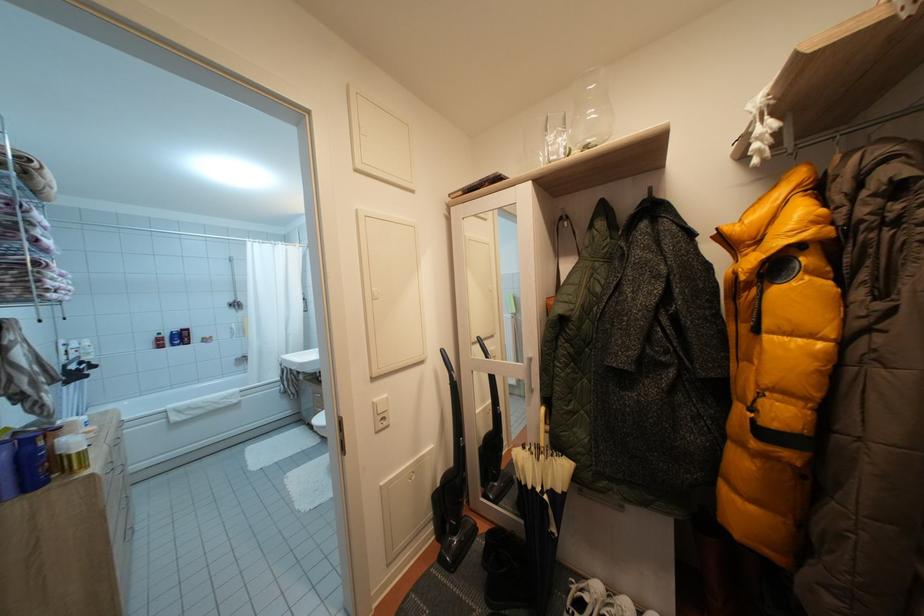
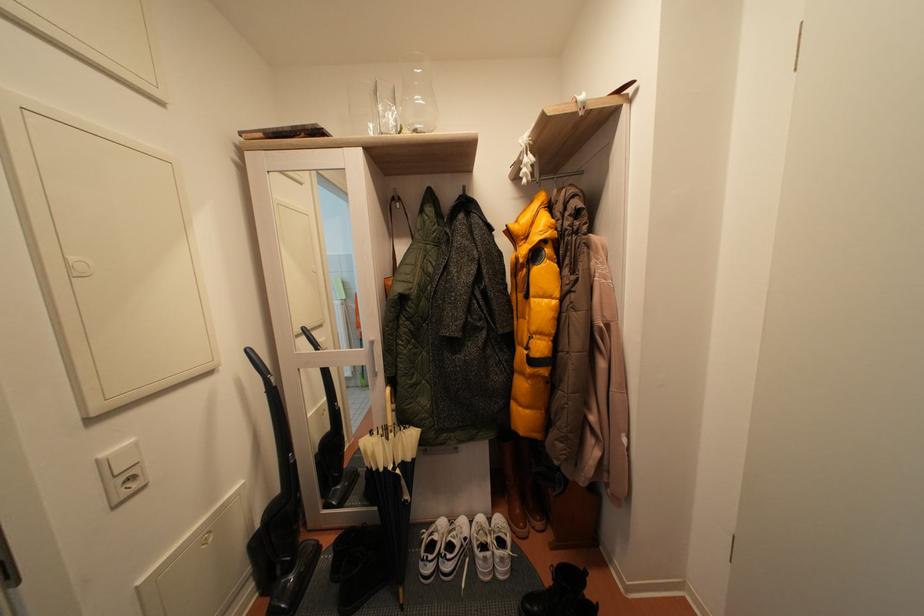
Where in the second image is the point corresponding to (x=383, y=406) from the first image?

(111, 460)